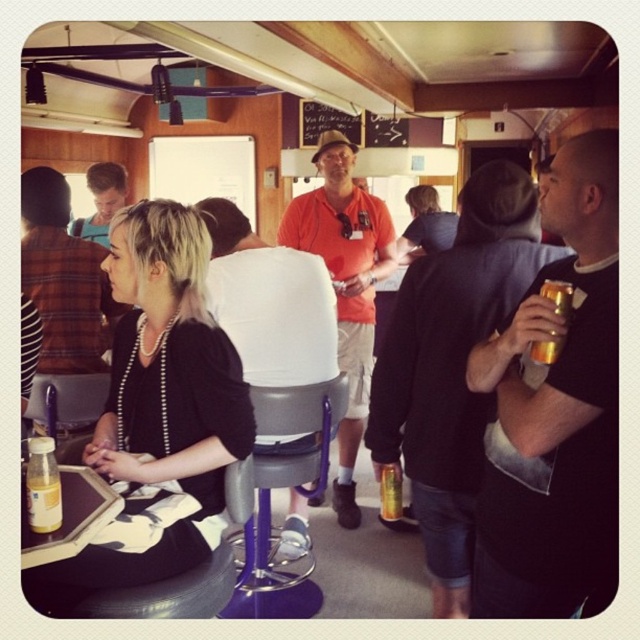
Question: Can you confirm if pearl necklace at center is bigger than translucent plastic bottle at lower left?

Choices:
 (A) yes
 (B) no

Answer: (A)

Question: Which object appears farthest from the camera in this image?

Choices:
 (A) orange t-shirt at center
 (B) translucent plastic bottle at lower left

Answer: (A)

Question: Which point appears closest to the camera in this image?

Choices:
 (A) (90, 236)
 (B) (502, 202)

Answer: (B)

Question: Which point is closer to the camera taking this photo?

Choices:
 (A) (333, 493)
 (B) (236, 577)

Answer: (B)

Question: Can you confirm if orange cotton shirt at center is thinner than metallic gray bar stool at center?

Choices:
 (A) yes
 (B) no

Answer: (B)

Question: Observing the image, what is the correct spatial positioning of orange t-shirt at center in reference to gold metallic can at center?

Choices:
 (A) right
 (B) left

Answer: (B)